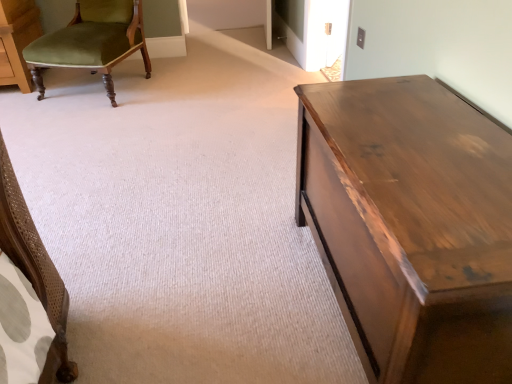
In order to click on blank space to the left of shiny brown wood table at right in this screenshot , I will do `click(216, 281)`.